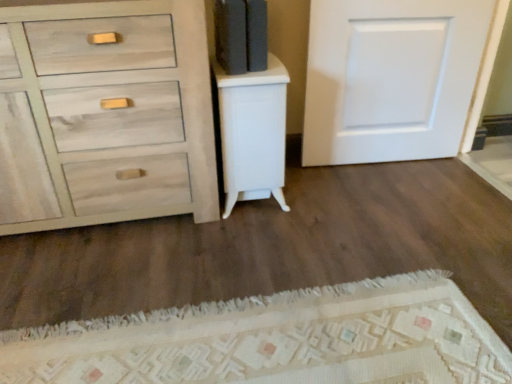
Question: Considering the positions of white matte door at upper right and light gray wood dresser at left in the image, is white matte door at upper right bigger or smaller than light gray wood dresser at left?

Choices:
 (A) big
 (B) small

Answer: (B)

Question: In the image, is white matte door at upper right positioned in front of or behind light gray wood dresser at left?

Choices:
 (A) behind
 (B) front

Answer: (A)

Question: Considering the real-world distances, which object is farthest from the white glossy cabinet at center?

Choices:
 (A) light gray wood dresser at left
 (B) white matte door at upper right

Answer: (B)

Question: Estimate the real-world distances between objects in this image. Which object is closer to the white matte door at upper right?

Choices:
 (A) white glossy cabinet at center
 (B) light gray wood dresser at left

Answer: (A)